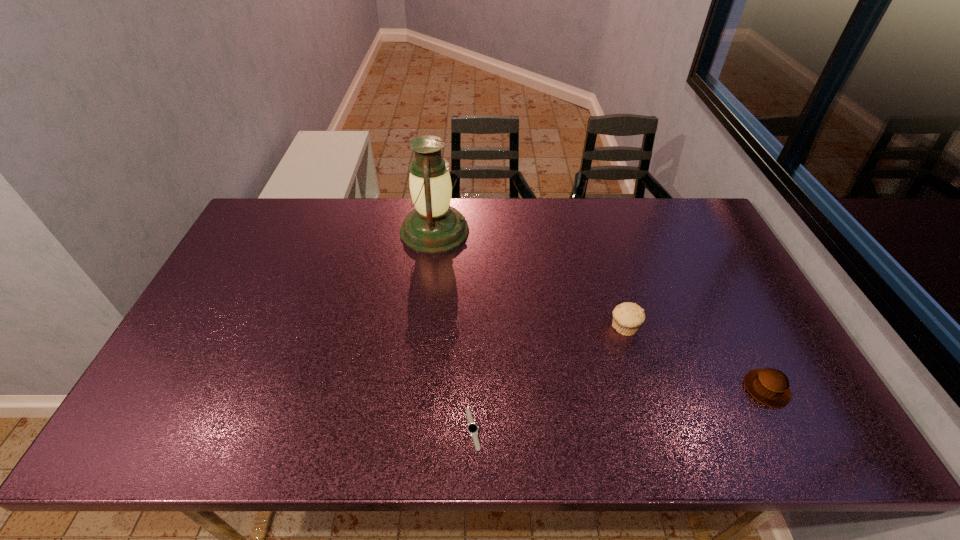
Locate which object ranks third in proximity to the shortest object. Please provide its 2D coordinates. Your answer should be formatted as a tuple, i.e. [(x, y)], where the tuple contains the x and y coordinates of a point satisfying the conditions above.

[(769, 386)]

The width and height of the screenshot is (960, 540). In order to click on free space in the image that satisfies the following two spatial constraints: 1. with the light compartment facing forward on the leftmost object; 2. on the left side of the right muffin in this screenshot , I will do `click(417, 389)`.

Where is `free location that satisfies the following two spatial constraints: 1. on the back side of the second object from right to left; 2. with the light compartment facing forward on the leftmost object`? free location that satisfies the following two spatial constraints: 1. on the back side of the second object from right to left; 2. with the light compartment facing forward on the leftmost object is located at coordinates (595, 231).

At what (x,y) coordinates should I click in order to perform the action: click on free spot that satisfies the following two spatial constraints: 1. with the light compartment facing forward on the third object from left to right; 2. on the right side of the lantern. Please return your answer as a coordinate pair (x, y). This screenshot has width=960, height=540. Looking at the image, I should click on (423, 328).

You are a GUI agent. You are given a task and a screenshot of the screen. Output one action in this format:
    pyautogui.click(x=<x>, y=<y>)
    Task: Click on the vacant space that satisfies the following two spatial constraints: 1. on the back side of the third object from right to left; 2. on the right side of the second object from right to left
    The height and width of the screenshot is (540, 960).
    Given the screenshot: What is the action you would take?
    pyautogui.click(x=474, y=328)

Where is `free space that satisfies the following two spatial constraints: 1. with the light compartment facing forward on the lantern; 2. on the left side of the nearest object`? free space that satisfies the following two spatial constraints: 1. with the light compartment facing forward on the lantern; 2. on the left side of the nearest object is located at coordinates (412, 429).

The width and height of the screenshot is (960, 540). Find the location of `blank space that satisfies the following two spatial constraints: 1. with the light compartment facing forward on the lantern; 2. on the back side of the taller muffin`. blank space that satisfies the following two spatial constraints: 1. with the light compartment facing forward on the lantern; 2. on the back side of the taller muffin is located at coordinates (423, 328).

Identify the location of free location that satisfies the following two spatial constraints: 1. with the light compartment facing forward on the shortest object; 2. on the left side of the leftmost object. (412, 429).

Locate an element on the screen. vacant point that satisfies the following two spatial constraints: 1. on the back side of the third object from left to right; 2. with the light compartment facing forward on the leftmost object is located at coordinates (595, 231).